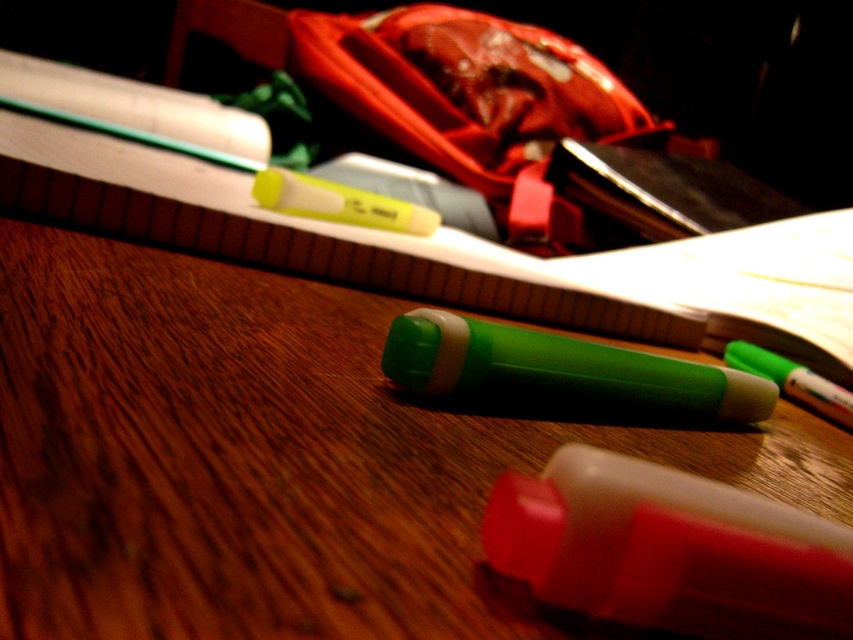
Question: Can you confirm if green plastic highlighter at center is positioned below green matte highlighter at center?

Choices:
 (A) no
 (B) yes

Answer: (A)

Question: In this image, where is green plastic highlighter at center located relative to yellow matte highlighter at upper left?

Choices:
 (A) above
 (B) below

Answer: (B)

Question: Which is nearer to the green plastic highlighter at center?

Choices:
 (A) yellow matte highlighter at upper left
 (B) green matte highlighter at center

Answer: (B)

Question: Which is farther from the green matte highlighter at center?

Choices:
 (A) translucent white crayon at center
 (B) green plastic highlighter at center

Answer: (A)

Question: Which point is farther to the camera?

Choices:
 (A) translucent white crayon at center
 (B) yellow matte highlighter at upper left
 (C) green plastic highlighter at center

Answer: (B)

Question: Does green plastic highlighter at center appear under green matte highlighter at center?

Choices:
 (A) no
 (B) yes

Answer: (A)